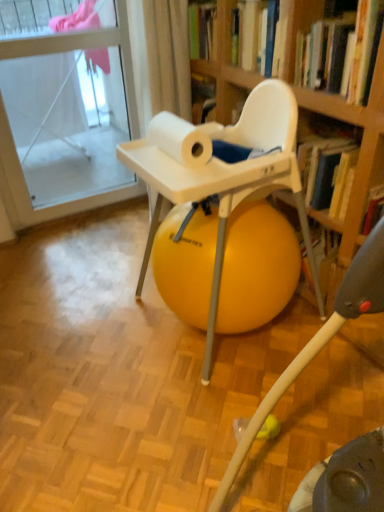
Question: From a real-world perspective, relative to hardcover book at upper right, is white matte paper towel at upper center vertically above or below?

Choices:
 (A) below
 (B) above

Answer: (A)

Question: Would you say white matte paper towel at upper center is to the left or to the right of hardcover book at upper right in the picture?

Choices:
 (A) right
 (B) left

Answer: (B)

Question: Which of these objects is positioned farthest from the yellow rubber ball at center?

Choices:
 (A) transparent glass door at upper left
 (B) white matte paper towel at upper center
 (C) hardcover book at upper right
 (D) yellow rubber ball at center

Answer: (A)

Question: Based on their relative distances, which object is nearer to the transparent glass door at upper left?

Choices:
 (A) yellow rubber ball at center
 (B) white matte paper towel at upper center
 (C) yellow rubber ball at center
 (D) hardcover book at upper right

Answer: (C)